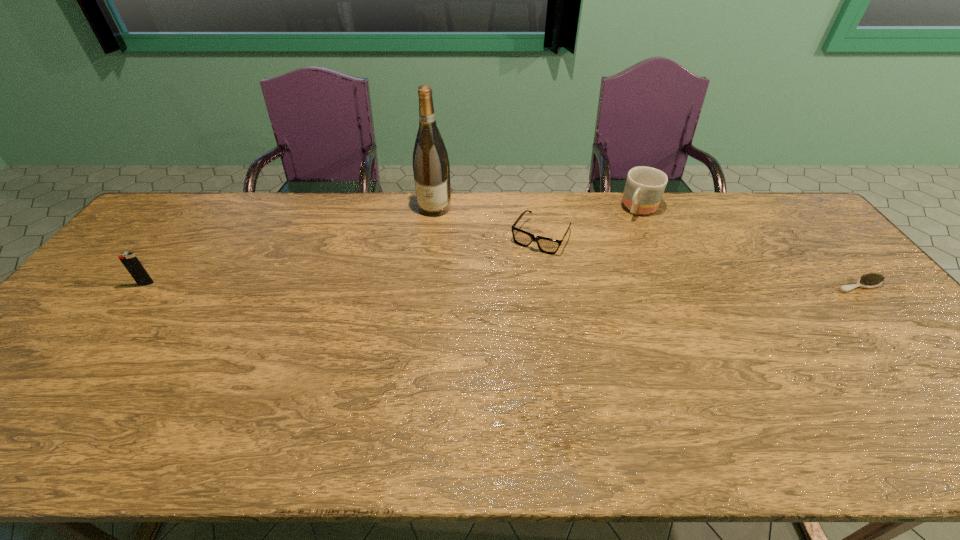
The image size is (960, 540). In order to click on wine bottle situated at the far edge in this screenshot , I will do `click(431, 168)`.

What are the coordinates of `sunglasses that is at the far edge` in the screenshot? It's located at (546, 245).

Image resolution: width=960 pixels, height=540 pixels. Find the location of `object that is at the left edge`. object that is at the left edge is located at coordinates tap(129, 260).

This screenshot has width=960, height=540. I want to click on object located at the right edge, so click(x=871, y=280).

Locate an element on the screen. This screenshot has height=540, width=960. free space at the far edge of the desktop is located at coordinates (212, 222).

In the image, there is a desktop. At what (x,y) coordinates should I click in order to perform the action: click on vacant space at the near edge. Please return your answer as a coordinate pair (x, y). This screenshot has width=960, height=540. Looking at the image, I should click on (704, 378).

Identify the location of free region at the left edge of the desktop. This screenshot has width=960, height=540. (111, 307).

The image size is (960, 540). What are the coordinates of `free point at the right edge` in the screenshot? It's located at (878, 309).

Where is `vacant space at the far right corner`? Image resolution: width=960 pixels, height=540 pixels. vacant space at the far right corner is located at coordinates (761, 206).

Identify the location of vacant space in between the second object from right to left and the igniter. (394, 247).